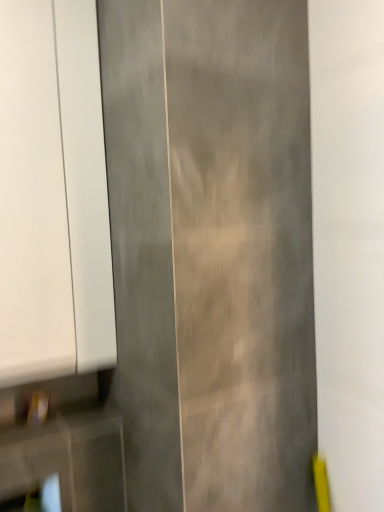
In order to face matte white glass door at left, should I rotate leftwards or rightwards?

Rotate your view left by about 19.440°.

Measure the distance between matte white glass door at left and camera.

matte white glass door at left and camera are 36.71 inches apart.

What do you see at coordinates (53, 194) in the screenshot?
I see `matte white glass door at left` at bounding box center [53, 194].

You are a GUI agent. You are given a task and a screenshot of the screen. Output one action in this format:
    pyautogui.click(x=<x>, y=<y>)
    Task: Click on the matte white glass door at left
    The width and height of the screenshot is (384, 512).
    Given the screenshot: What is the action you would take?
    pyautogui.click(x=53, y=194)

Locate an element on the screen. The image size is (384, 512). matte white glass door at left is located at coordinates (53, 194).